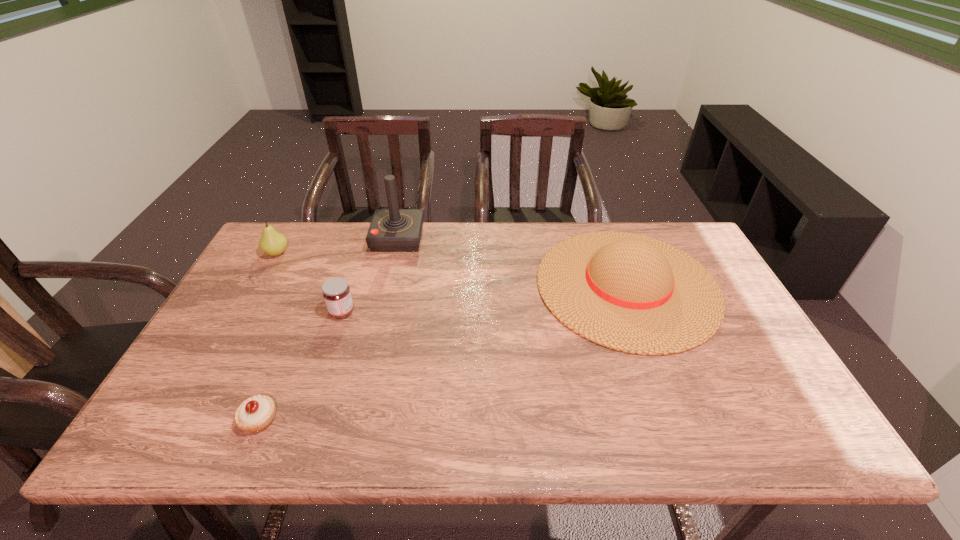
You are a GUI agent. You are given a task and a screenshot of the screen. Output one action in this format:
    pyautogui.click(x=<x>, y=<y>)
    Task: Click on the vacant space at the far edge of the desktop
    The image size is (960, 540).
    Given the screenshot: What is the action you would take?
    pyautogui.click(x=324, y=251)

Locate an element on the screen. The width and height of the screenshot is (960, 540). free location at the near edge is located at coordinates (306, 441).

The image size is (960, 540). Identify the location of vacant area at the left edge of the desktop. (290, 277).

Find the location of a particular element. Image resolution: width=960 pixels, height=540 pixels. free space at the right edge of the desktop is located at coordinates (712, 358).

Image resolution: width=960 pixels, height=540 pixels. Identify the location of free location at the far left corner of the desktop. (303, 231).

Where is `vacant area at the far right corner`? The height and width of the screenshot is (540, 960). vacant area at the far right corner is located at coordinates (695, 241).

The height and width of the screenshot is (540, 960). Find the location of `free space between the rightmost object and the joystick`. free space between the rightmost object and the joystick is located at coordinates (513, 262).

The image size is (960, 540). I want to click on vacant point located between the tallest object and the jam, so click(370, 275).

Locate an element on the screen. The width and height of the screenshot is (960, 540). vacant space that's between the jam and the shortest object is located at coordinates (300, 366).

Locate an element on the screen. The height and width of the screenshot is (540, 960). unoccupied position between the tallest object and the jam is located at coordinates (370, 275).